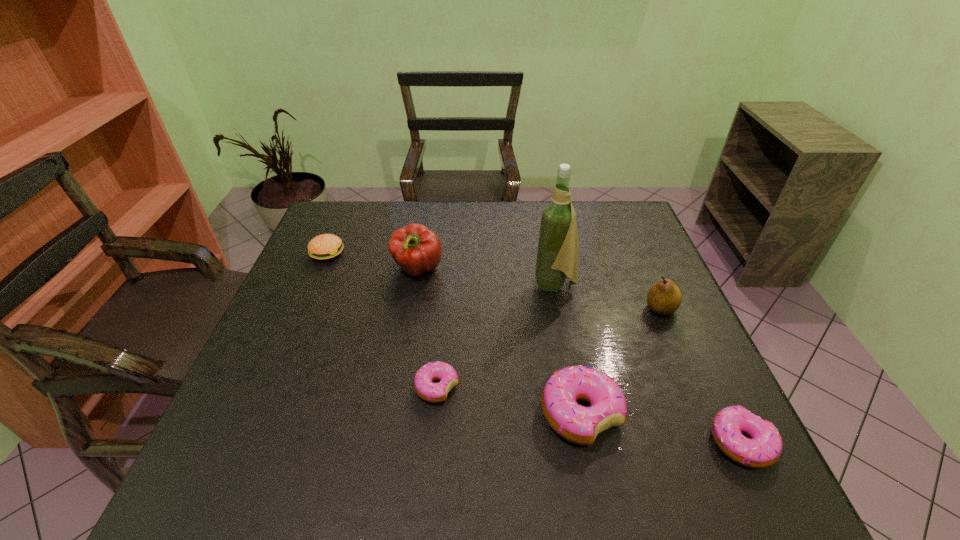
Locate an element on the screen. The height and width of the screenshot is (540, 960). vacant space that satisfies the following two spatial constraints: 1. on the front side of the shortest doughnut; 2. on the left side of the second tallest object is located at coordinates (398, 387).